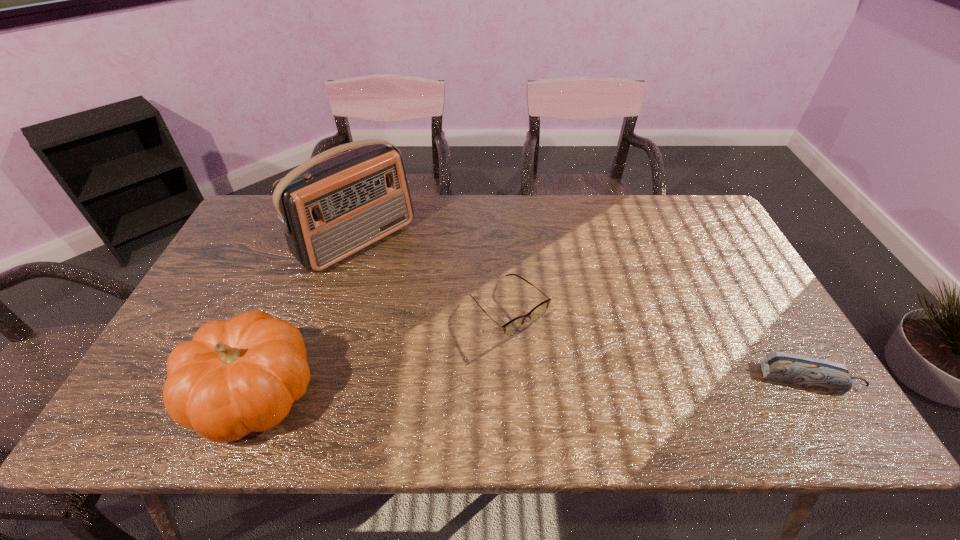
Locate an element on the screen. free space located 0.150m on the face of the third object from left to right is located at coordinates (577, 375).

Identify the location of vacant area located 0.080m on the face of the third object from left to right. (557, 355).

Where is `object situated at the far edge`? The width and height of the screenshot is (960, 540). object situated at the far edge is located at coordinates (329, 209).

The width and height of the screenshot is (960, 540). Find the location of `pumpkin situated at the near edge`. pumpkin situated at the near edge is located at coordinates (237, 376).

Where is `pencil box present at the near edge`? This screenshot has width=960, height=540. pencil box present at the near edge is located at coordinates (804, 371).

Where is `object that is positioned at the left edge`? object that is positioned at the left edge is located at coordinates (237, 376).

The height and width of the screenshot is (540, 960). What are the coordinates of `object present at the right edge` in the screenshot? It's located at (804, 371).

Locate an element on the screen. The width and height of the screenshot is (960, 540). object at the near left corner is located at coordinates (237, 376).

At what (x,y) coordinates should I click in order to perform the action: click on object at the near right corner. Please return your answer as a coordinate pair (x, y). Looking at the image, I should click on (804, 371).

Where is `free location at the far edge of the desktop`? The width and height of the screenshot is (960, 540). free location at the far edge of the desktop is located at coordinates (589, 218).